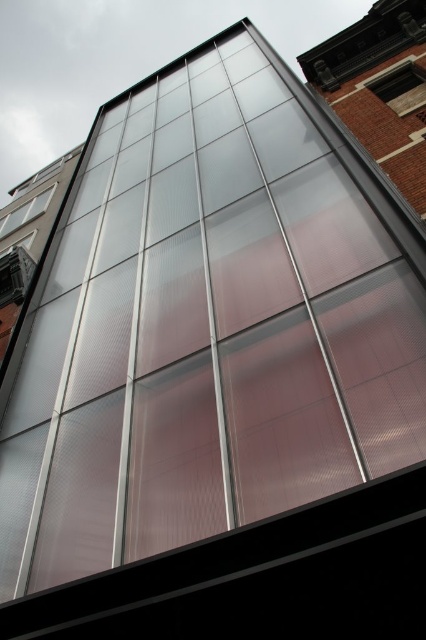
In the scene shown: You are standing in front of the modern architectural structure and notice two clear glass windows. One is labeled as the clear glass window at upper right and the other as the clear glass window at upper left. From your perspective, which window is positioned to the right side?

The clear glass window at upper right is positioned to the right of the clear glass window at upper left, so the clear glass window at upper right is on the right side.